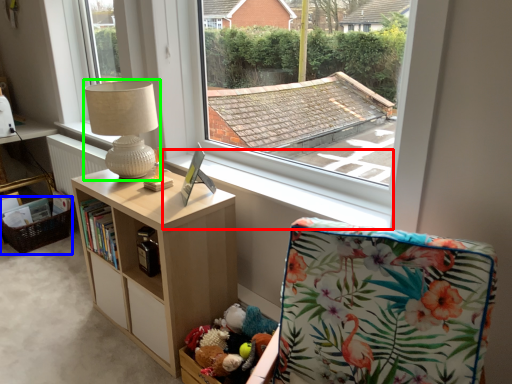
Question: Which object is positioned farthest from window sill (highlighted by a red box)? Select from basket (highlighted by a blue box) and table lamp (highlighted by a green box).

Choices:
 (A) basket
 (B) table lamp

Answer: (A)